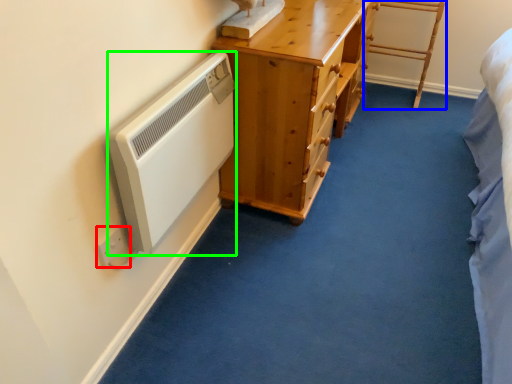
Question: Estimate the real-world distances between objects in this image. Which object is farther from electric outlet (highlighted by a red box), furniture (highlighted by a blue box) or appliance (highlighted by a green box)?

Choices:
 (A) furniture
 (B) appliance

Answer: (A)